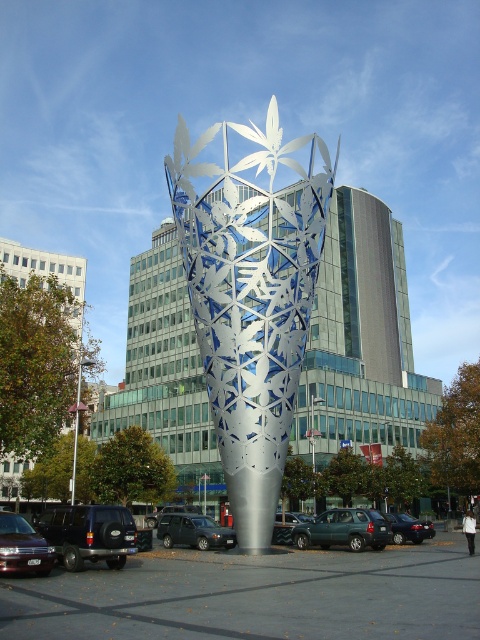
Does point (425, 573) come farther from viewer compared to point (387, 516)?

No.

Which is below, metallic gray parking lot at center or shiny black sedan at lower right?

shiny black sedan at lower right is below.

Locate an element on the screen. metallic gray parking lot at center is located at coordinates coord(255,595).

Which of these two, silver metallic sculpture at center or dark gray metallic suv at center, stands shorter?

Standing shorter between the two is dark gray metallic suv at center.

Which is behind, point (271, 355) or point (187, 525)?

The point (187, 525) is behind.

Where is `silver metallic sculpture at center`? silver metallic sculpture at center is located at coordinates (251, 296).

Is point (106, 513) in front of point (13, 538)?

No, (106, 513) is behind (13, 538).

Is black matte suv at lower left smaller than shiny black sedan at lower left?

Incorrect, black matte suv at lower left is not smaller in size than shiny black sedan at lower left.

Does point (118, 513) lie in front of point (14, 529)?

That is False.

This screenshot has height=640, width=480. What are the coordinates of `black matte suv at lower left` in the screenshot? It's located at (88, 532).